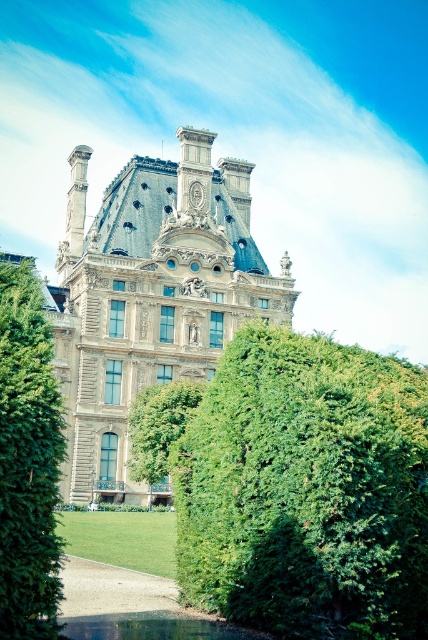
You are a landscape architect designing a walking path between the green leafy bush at center and the green grassy pond at lower center. What is the minimum width required for the path to ensure visitors can comfortably walk between them without needing to detour around the objects?

The distance between the green leafy bush at center and the green grassy pond at lower center is 7.10 meters. Therefore, the path should be at least 7.10 meters wide to allow visitors to walk directly between them without detouring.

You are standing in front of the grand historical building and want to place a small decorative statue exactly at the center of the green leafy bush at center. Where should you place the statue?

The green leafy bush at center is located at point (306, 490), so you should place the statue at its center coordinates, which would be approximately at point (306, 490).